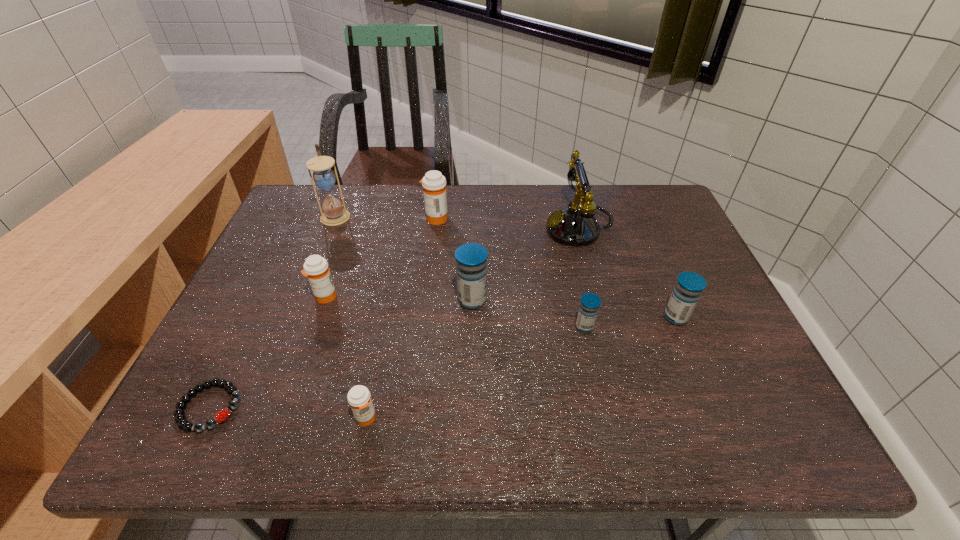
You are a GUI agent. You are given a task and a screenshot of the screen. Output one action in this format:
    pyautogui.click(x=<x>, y=<y>)
    Task: Click on the vacant space that is in between the second blue medicine from right to left and the fourth medicine from right to left
    The width and height of the screenshot is (960, 540).
    Given the screenshot: What is the action you would take?
    pyautogui.click(x=510, y=273)

Where is `free space between the smallest blue medicine and the rightmost medicine`? The height and width of the screenshot is (540, 960). free space between the smallest blue medicine and the rightmost medicine is located at coordinates (630, 322).

Locate an element on the screen. This screenshot has height=540, width=960. free space between the farthest orange medicine and the fourth object from left to right is located at coordinates (401, 318).

Locate an element on the screen. Image resolution: width=960 pixels, height=540 pixels. object that stands as the sixth closest to the white hourglass is located at coordinates (359, 398).

You are a GUI agent. You are given a task and a screenshot of the screen. Output one action in this format:
    pyautogui.click(x=<x>, y=<y>)
    Task: Click on the object that is the fourth closest to the third medicine from right to left
    The height and width of the screenshot is (540, 960).
    Given the screenshot: What is the action you would take?
    pyautogui.click(x=359, y=398)

I want to click on the fifth closest medicine relative to the nearest orange medicine, so click(689, 286).

Where is `medicine that is the fourth closest to the telephone`? medicine that is the fourth closest to the telephone is located at coordinates (434, 183).

This screenshot has height=540, width=960. Identify the location of the third closest orange medicine to the black telephone. (359, 398).

Select which orange medicine appears as the closest to the white hourglass. Please provide its 2D coordinates. Your answer should be formatted as a tuple, i.e. [(x, y)], where the tuple contains the x and y coordinates of a point satisfying the conditions above.

[(434, 183)]

At what (x,y) coordinates should I click in order to perform the action: click on blue medicine identified as the second closest to the smallest blue medicine. Please return your answer as a coordinate pair (x, y). Looking at the image, I should click on (471, 258).